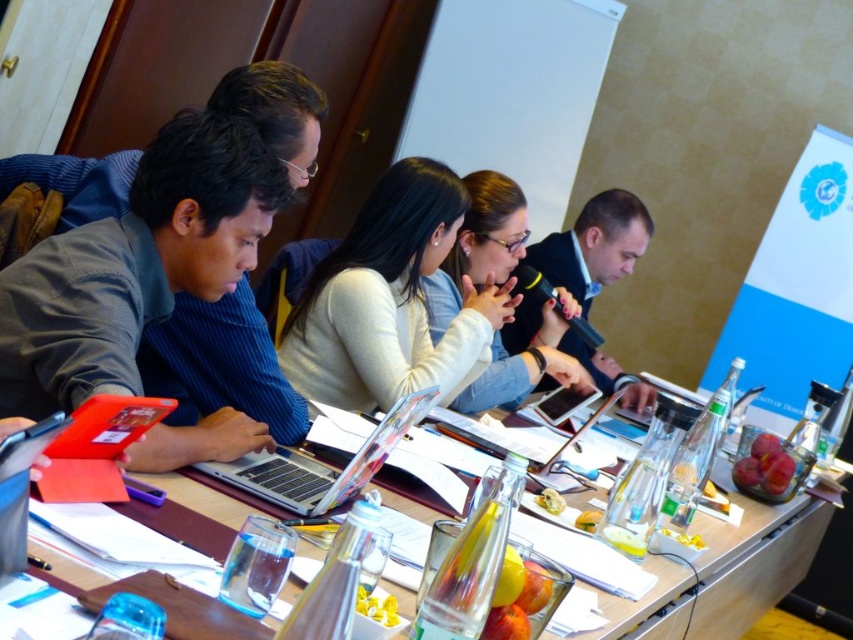
Is clear plastic water at center positioned before silver metallic laptop at center?

Yes, clear plastic water at center is closer to the viewer.

Does clear plastic water at center have a larger size compared to silver metallic laptop at center?

Indeed, clear plastic water at center has a larger size compared to silver metallic laptop at center.

The image size is (853, 640). What do you see at coordinates (724, 573) in the screenshot?
I see `clear plastic water at center` at bounding box center [724, 573].

Where is `clear plastic water at center`? The width and height of the screenshot is (853, 640). clear plastic water at center is located at coordinates (724, 573).

Can you confirm if matte black laptop at left is positioned below matte black microphone at center?

Yes, matte black laptop at left is below matte black microphone at center.

Is the position of matte black laptop at left more distant than that of matte black microphone at center?

That is False.

This screenshot has height=640, width=853. What do you see at coordinates (135, 264) in the screenshot?
I see `matte black laptop at left` at bounding box center [135, 264].

Where is `matte black laptop at left`? Image resolution: width=853 pixels, height=640 pixels. matte black laptop at left is located at coordinates (135, 264).

Does matte black microphone at center appear under silver metallic laptop at center?

Incorrect, matte black microphone at center is not positioned below silver metallic laptop at center.

Does matte black microphone at center have a lesser height compared to silver metallic laptop at center?

No, matte black microphone at center is not shorter than silver metallic laptop at center.

Is point (602, 241) positioned before point (318, 496)?

No, it is not.

I want to click on matte black microphone at center, so click(595, 244).